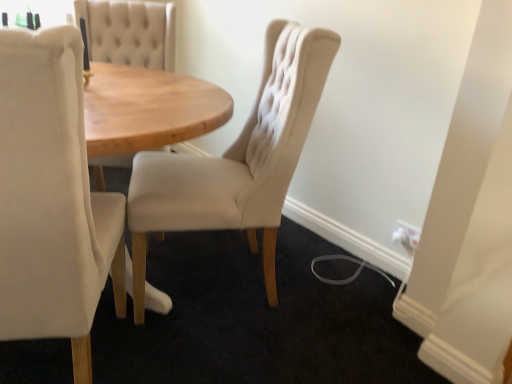
Locate an element on the screen. free space to the right of beige fabric chair at center, which is the second chair from left to right is located at coordinates tap(328, 302).